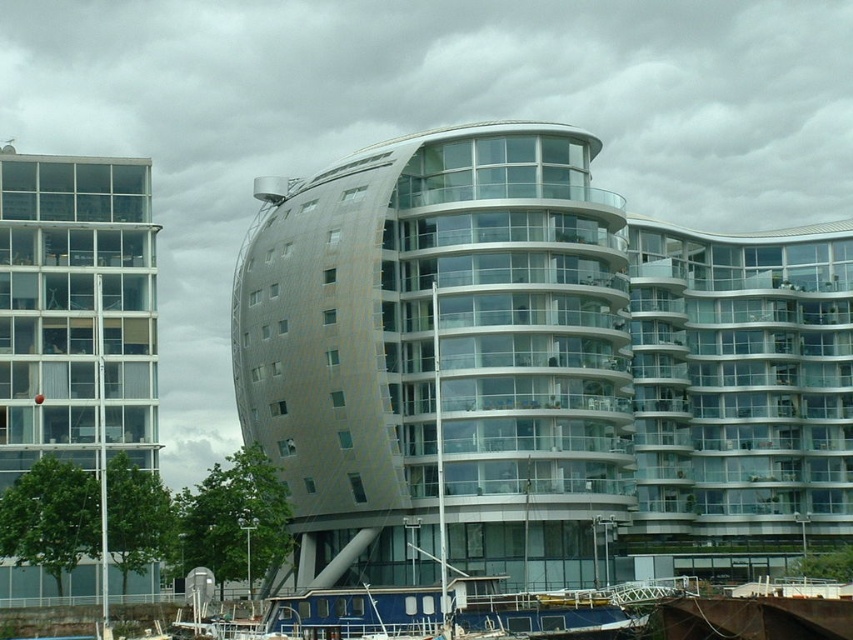
Question: Which point is farther from the camera taking this photo?

Choices:
 (A) pos(665,346)
 (B) pos(140,188)

Answer: (A)

Question: Which point is farther to the camera?

Choices:
 (A) sleek metallic building at center
 (B) clear glass building at left

Answer: (B)

Question: Is sleek metallic building at center above clear glass building at left?

Choices:
 (A) no
 (B) yes

Answer: (B)

Question: Is sleek metallic building at center positioned in front of clear glass building at left?

Choices:
 (A) no
 (B) yes

Answer: (B)

Question: Which point is farther to the camera?

Choices:
 (A) sleek metallic building at center
 (B) clear glass building at left

Answer: (B)

Question: Is sleek metallic building at center closer to camera compared to clear glass building at left?

Choices:
 (A) no
 (B) yes

Answer: (B)